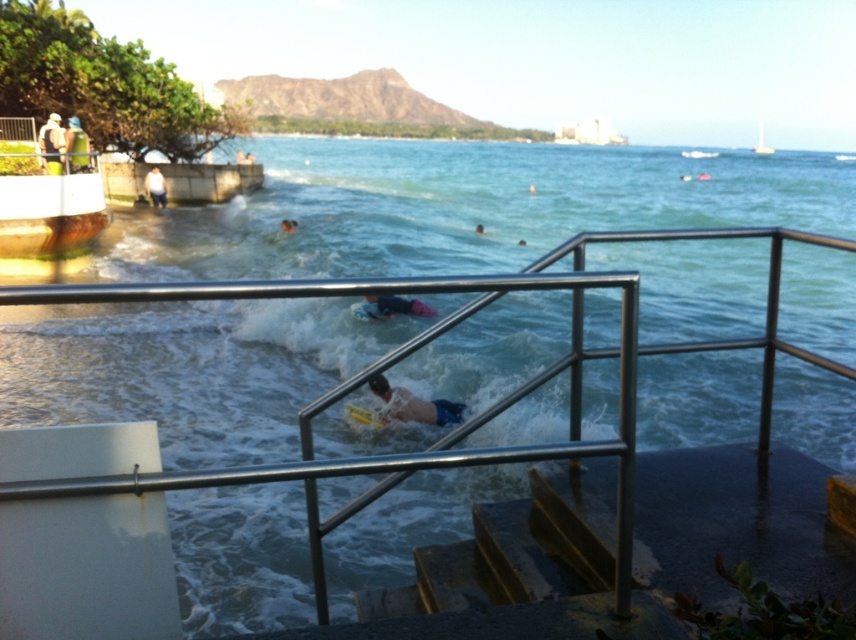
Question: Is rusty metal stairs at lower center above matte black surfboard at upper left?

Choices:
 (A) no
 (B) yes

Answer: (A)

Question: Does blue fabric swimmer at center have a greater width compared to green fabric bag at upper left?

Choices:
 (A) no
 (B) yes

Answer: (A)

Question: Which is nearer to the matte black surfboard at upper left?

Choices:
 (A) green fabric bag at upper left
 (B) light blue fabric shirt at upper left
 (C) rusty metal stairs at lower center
 (D) blue fabric swimmer at center

Answer: (A)

Question: Which point is closer to the camera?

Choices:
 (A) (164, 180)
 (B) (536, 552)
 (C) (57, 115)

Answer: (B)

Question: Can you confirm if white matte surfboard at center is positioned below green fabric bag at upper left?

Choices:
 (A) yes
 (B) no

Answer: (A)

Question: Which of the following is the farthest from the observer?

Choices:
 (A) (295, 221)
 (B) (75, 128)
 (C) (52, 131)

Answer: (A)